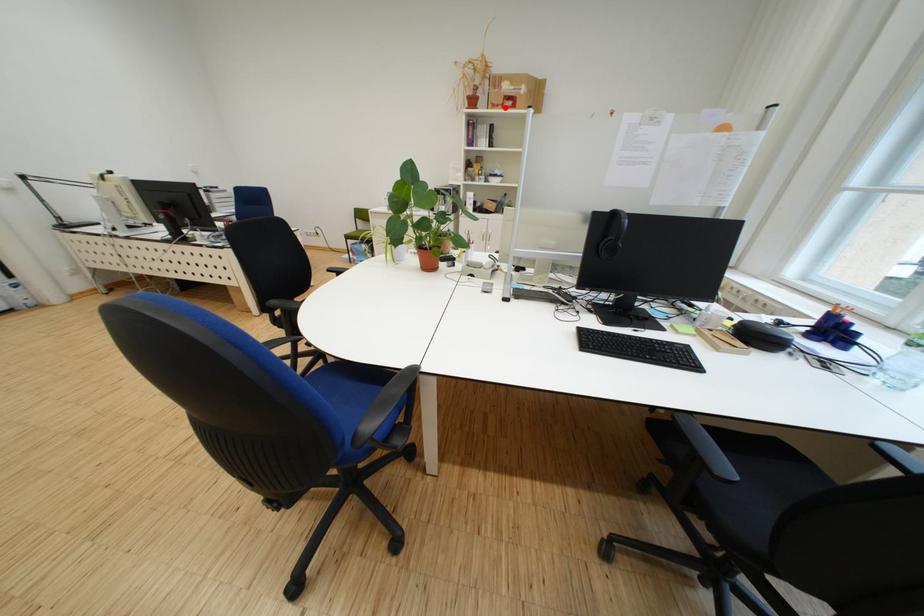
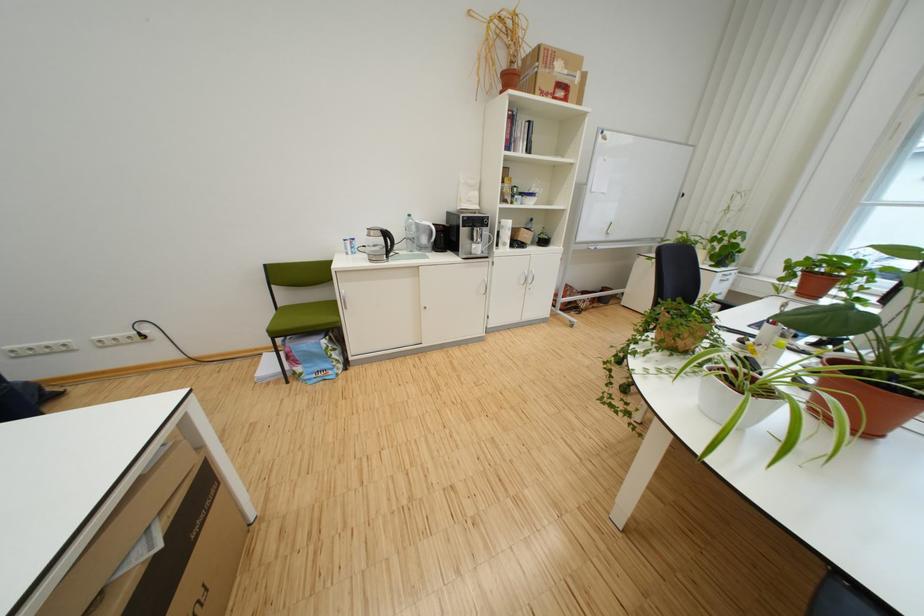
In the second image, find the point that corresponds to the highlighted location in the first image.

(553, 95)